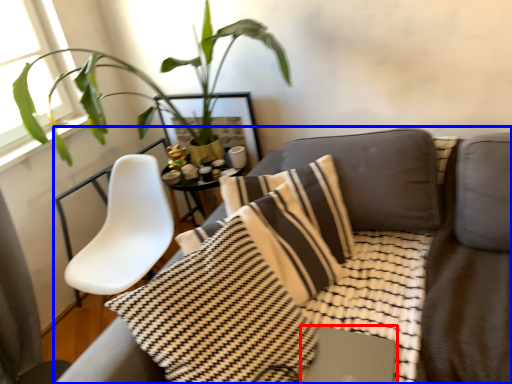
Question: Which point is further to the camera, computer (highlighted by a red box) or studio couch (highlighted by a blue box)?

Choices:
 (A) computer
 (B) studio couch

Answer: (A)